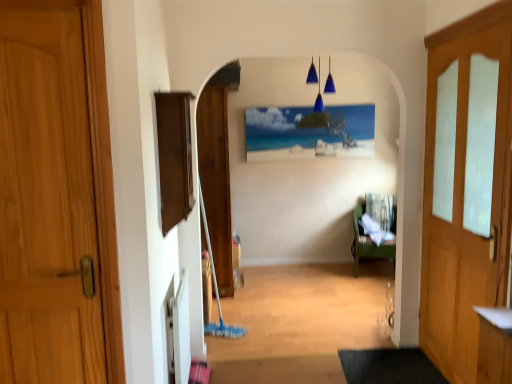
The width and height of the screenshot is (512, 384). Find the location of `blank space situated above matte canvas painting at center (from a real-world perspective)`. blank space situated above matte canvas painting at center (from a real-world perspective) is located at coordinates (325, 104).